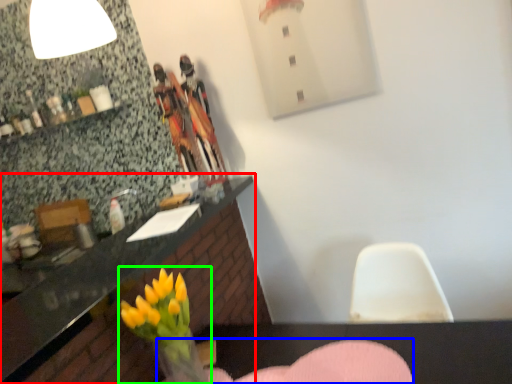
Question: Which object is the closest to the countertop (highlighted by a red box)? Choose among these: armchair (highlighted by a blue box) or floral arrangement (highlighted by a green box).

Choices:
 (A) armchair
 (B) floral arrangement

Answer: (B)